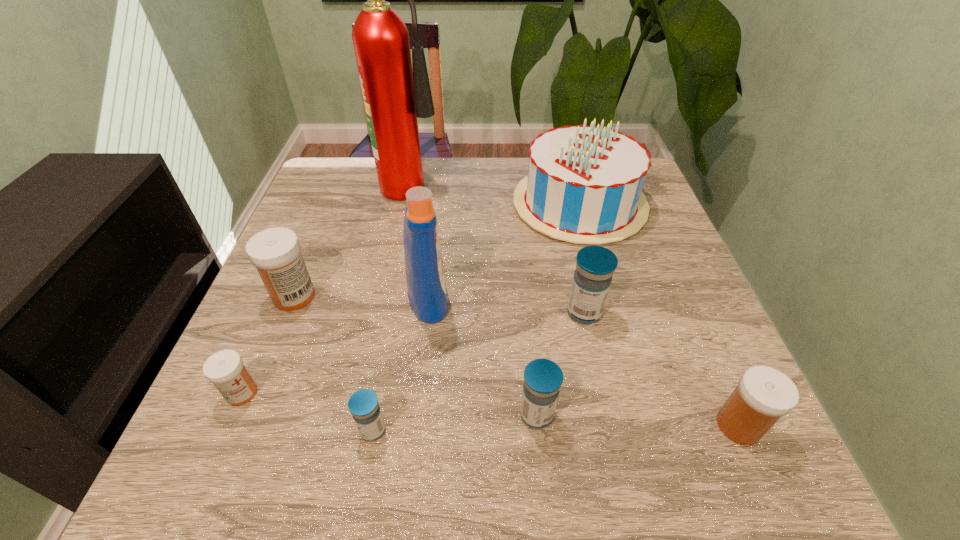
Identify which white medicine is located as the second nearest to the smallest white medicine. Please provide its 2D coordinates. Your answer should be formatted as a tuple, i.e. [(x, y)], where the tuple contains the x and y coordinates of a point satisfying the conditions above.

[(764, 394)]

Find the location of `the second closest white medicine to the birthday cake`. the second closest white medicine to the birthday cake is located at coordinates (275, 252).

Choose which blue medicine is the third nearest neighbor to the smallest white medicine. Please provide its 2D coordinates. Your answer should be formatted as a tuple, i.e. [(x, y)], where the tuple contains the x and y coordinates of a point satisfying the conditions above.

[(595, 266)]

Select which blue medicine is the third closest to the smallest white medicine. Please provide its 2D coordinates. Your answer should be formatted as a tuple, i.e. [(x, y)], where the tuple contains the x and y coordinates of a point satisfying the conditions above.

[(595, 266)]

Image resolution: width=960 pixels, height=540 pixels. In order to click on blank area in the image that satisfies the following two spatial constraints: 1. at the nozzle of the tallest object; 2. on the back side of the white birthday cake in this screenshot , I will do `click(408, 204)`.

I want to click on vacant space that satisfies the following two spatial constraints: 1. on the label of the second medicine from right to left; 2. on the left side of the eighth shortest object, so click(426, 313).

This screenshot has width=960, height=540. What are the coordinates of `vacant point that satisfies the following two spatial constraints: 1. at the nozzle of the tallest object; 2. on the left side of the second biggest white medicine` in the screenshot? It's located at (364, 426).

This screenshot has width=960, height=540. I want to click on vacant point that satisfies the following two spatial constraints: 1. at the nozzle of the farthest blue medicine; 2. on the right side of the red fire extinguisher, so click(x=386, y=313).

Where is `vacant position in the image that satisfies the following two spatial constraints: 1. on the label of the second tallest object; 2. on the right side of the second biggest blue medicine`? vacant position in the image that satisfies the following two spatial constraints: 1. on the label of the second tallest object; 2. on the right side of the second biggest blue medicine is located at coordinates (416, 415).